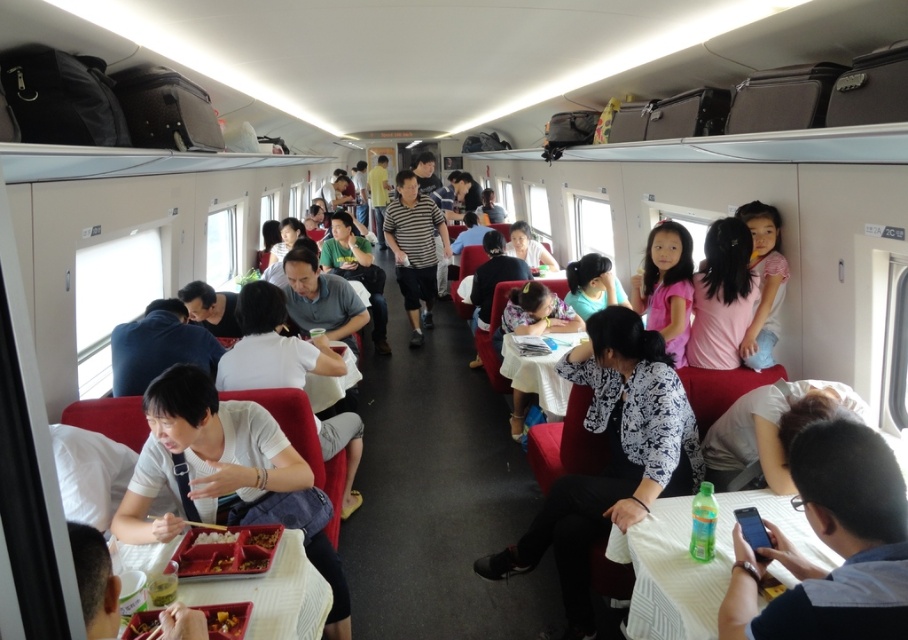
Is pink satin dress at center below brown matte food at lower center?

No.

Does point (657, 243) lie in front of point (263, 536)?

No, it is not.

Find the location of a particular element. The width and height of the screenshot is (908, 640). pink satin dress at center is located at coordinates (666, 285).

Between white printed blouse at center and white glossy chopsticks at lower center, which one has less height?

white glossy chopsticks at lower center is shorter.

Is white printed blouse at center closer to the viewer compared to white glossy chopsticks at lower center?

No, white printed blouse at center is further to the viewer.

Is point (638, 336) closer to viewer compared to point (195, 538)?

No, (638, 336) is further to viewer.

I want to click on white printed blouse at center, so click(x=610, y=458).

Is point (564, 374) in front of point (225, 616)?

No, it is behind (225, 616).

Between white printed blouse at center and shiny plastic container at lower left, which one appears on the left side from the viewer's perspective?

shiny plastic container at lower left

You are a GUI agent. You are given a task and a screenshot of the screen. Output one action in this format:
    pyautogui.click(x=<x>, y=<y>)
    Task: Click on the white printed blouse at center
    This screenshot has width=908, height=640.
    Given the screenshot: What is the action you would take?
    pyautogui.click(x=610, y=458)